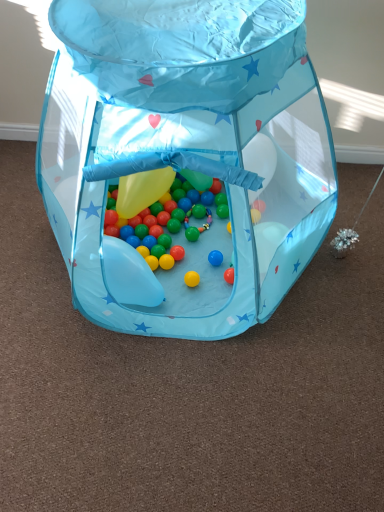
Question: Can we say shiny plastic beads at center lies outside shiny metallic ball at center?

Choices:
 (A) yes
 (B) no

Answer: (B)

Question: Is shiny plastic beads at center placed right next to shiny metallic ball at center?

Choices:
 (A) no
 (B) yes

Answer: (A)

Question: Would you say shiny plastic beads at center contains shiny metallic ball at center?

Choices:
 (A) yes
 (B) no

Answer: (B)

Question: Is the depth of shiny plastic beads at center greater than that of shiny metallic ball at center?

Choices:
 (A) yes
 (B) no

Answer: (A)

Question: Is shiny plastic beads at center oriented towards shiny metallic ball at center?

Choices:
 (A) no
 (B) yes

Answer: (B)

Question: Is shiny plastic beads at center wider than shiny metallic ball at center?

Choices:
 (A) yes
 (B) no

Answer: (B)

Question: Is translucent plastic balloon at lower left facing towards shiny plastic beads at center?

Choices:
 (A) yes
 (B) no

Answer: (B)

Question: From the image's perspective, is translucent plastic balloon at lower left below shiny plastic beads at center?

Choices:
 (A) yes
 (B) no

Answer: (A)

Question: Is translucent plastic balloon at lower left not inside shiny plastic beads at center?

Choices:
 (A) no
 (B) yes

Answer: (B)

Question: From a real-world perspective, is translucent plastic balloon at lower left positioned over shiny plastic beads at center based on gravity?

Choices:
 (A) yes
 (B) no

Answer: (A)

Question: Is translucent plastic balloon at lower left turned away from shiny plastic beads at center?

Choices:
 (A) yes
 (B) no

Answer: (A)

Question: From a real-world perspective, is translucent plastic balloon at lower left under shiny plastic beads at center?

Choices:
 (A) no
 (B) yes

Answer: (A)

Question: Is the position of shiny metallic ball at center less distant than that of translucent plastic balloon at lower left?

Choices:
 (A) no
 (B) yes

Answer: (B)